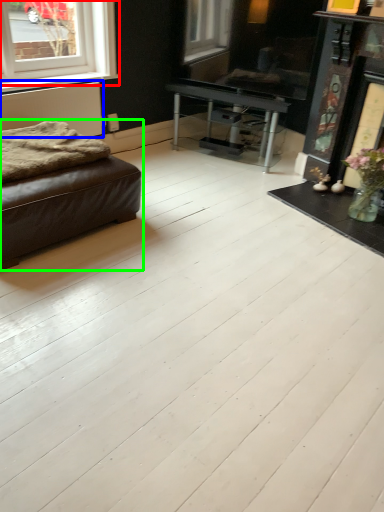
Question: Which object is positioned closest to window (highlighted by a red box)? Select from radiator (highlighted by a blue box) and studio couch (highlighted by a green box).

Choices:
 (A) radiator
 (B) studio couch

Answer: (A)